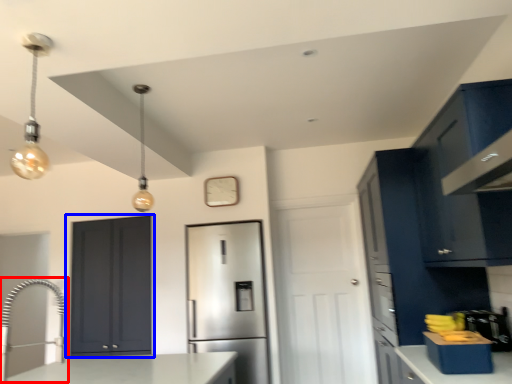
Question: Among these objects, which one is farthest to the camera, faucet (highlighted by a red box) or door (highlighted by a blue box)?

Choices:
 (A) faucet
 (B) door

Answer: (B)